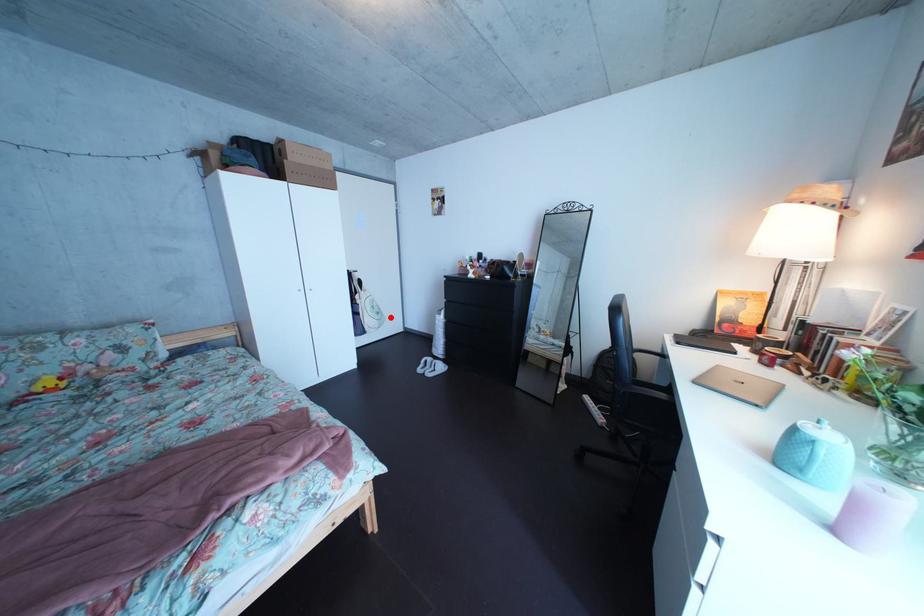
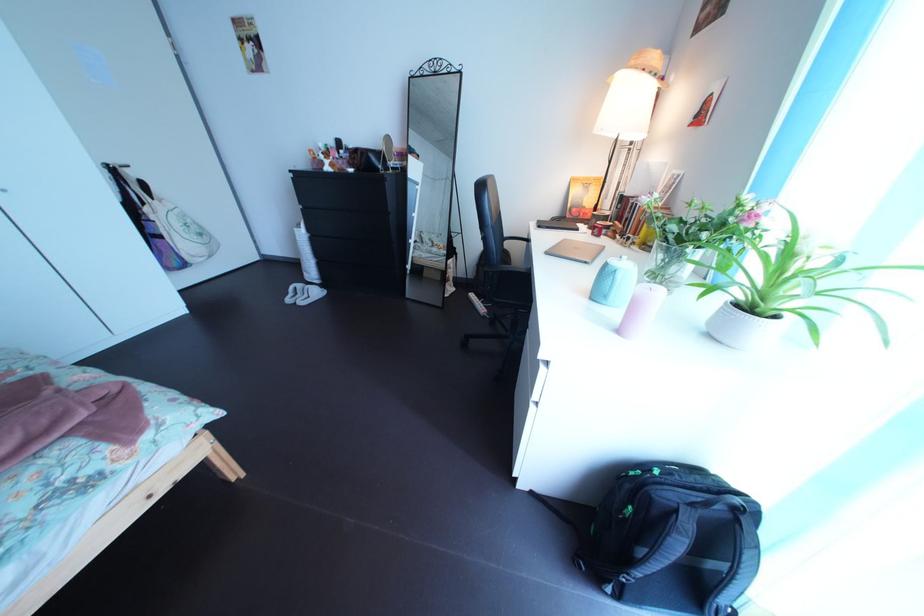
In the second image, find the point that corresponds to the highlighted location in the first image.

(209, 237)